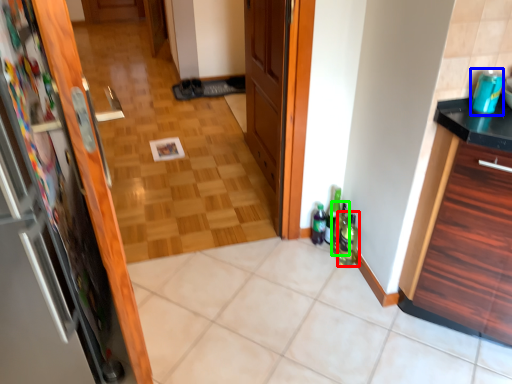
Question: Which is farther away from beverage (highlighted by a red box)? beverage (highlighted by a blue box) or bottle (highlighted by a green box)?

Choices:
 (A) beverage
 (B) bottle

Answer: (A)